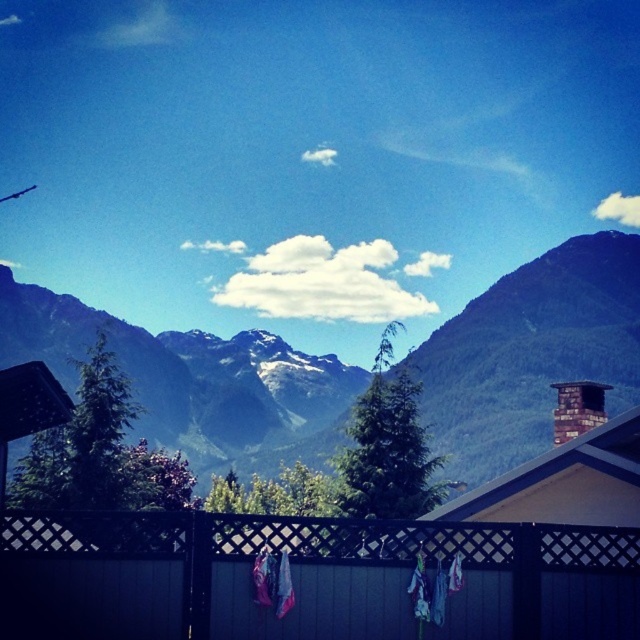
Between point (108, 560) and point (448, 582), which one is positioned behind?

The point (448, 582) is behind.

Consider the image. Which is more to the right, black wood fence at center or multicolored fabric at center?

From the viewer's perspective, multicolored fabric at center appears more on the right side.

Between point (72, 589) and point (419, 600), which one is positioned behind?

Point (419, 600)

Locate an element on the screen. This screenshot has width=640, height=640. black wood fence at center is located at coordinates (308, 577).

Is point (92, 531) closer to camera compared to point (529, 456)?

Yes, point (92, 531) is closer to viewer.

Identify the location of black wood fence at center. click(308, 577).

At what (x,y) coordinates should I click in order to perform the action: click on black wood fence at center. Please return your answer as a coordinate pair (x, y). Looking at the image, I should click on (308, 577).

Can you confirm if brick chimney at upper right is bigger than multicolored fabric at center?

Yes.

Between brick chimney at upper right and multicolored fabric at center, which one appears on the left side from the viewer's perspective?

From the viewer's perspective, multicolored fabric at center appears more on the left side.

What do you see at coordinates (577, 408) in the screenshot? I see `brick chimney at upper right` at bounding box center [577, 408].

The width and height of the screenshot is (640, 640). Find the location of `brick chimney at upper right`. brick chimney at upper right is located at coordinates (x=577, y=408).